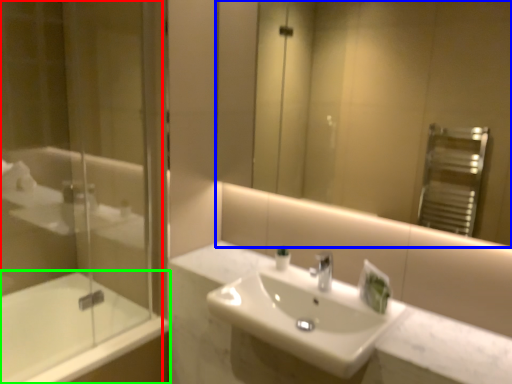
Question: Estimate the real-world distances between objects in this image. Which object is farther from shower door (highlighted by a red box), mirror (highlighted by a blue box) or bathtub (highlighted by a green box)?

Choices:
 (A) mirror
 (B) bathtub

Answer: (A)